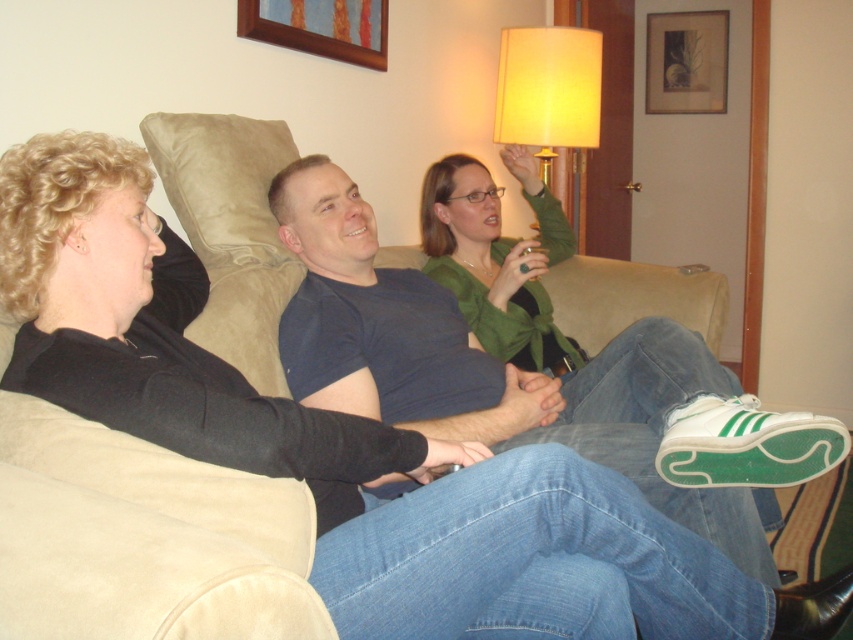
Who is more forward, (581, 454) or (567, 108)?

Point (581, 454) is more forward.

Does blue cotton t-shirt at center have a smaller size compared to yellow fabric lampshade at upper center?

Incorrect, blue cotton t-shirt at center is not smaller in size than yellow fabric lampshade at upper center.

Find the location of `blue cotton t-shirt at center`. blue cotton t-shirt at center is located at coordinates (483, 364).